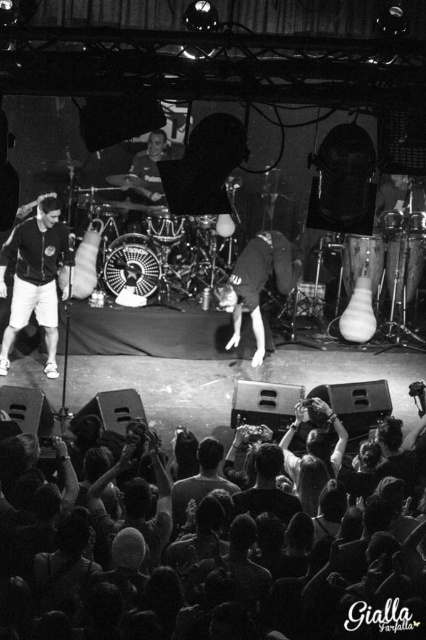
Question: In this image, where is dark textured crowd at lower center located relative to black matte shorts at left?

Choices:
 (A) right
 (B) left

Answer: (A)

Question: Among these points, which one is nearest to the camera?

Choices:
 (A) (405, 620)
 (B) (25, 314)

Answer: (A)

Question: Is dark textured crowd at lower center further to the viewer compared to black matte shorts at left?

Choices:
 (A) no
 (B) yes

Answer: (A)

Question: Can you confirm if dark textured crowd at lower center is bigger than black matte shorts at left?

Choices:
 (A) no
 (B) yes

Answer: (B)